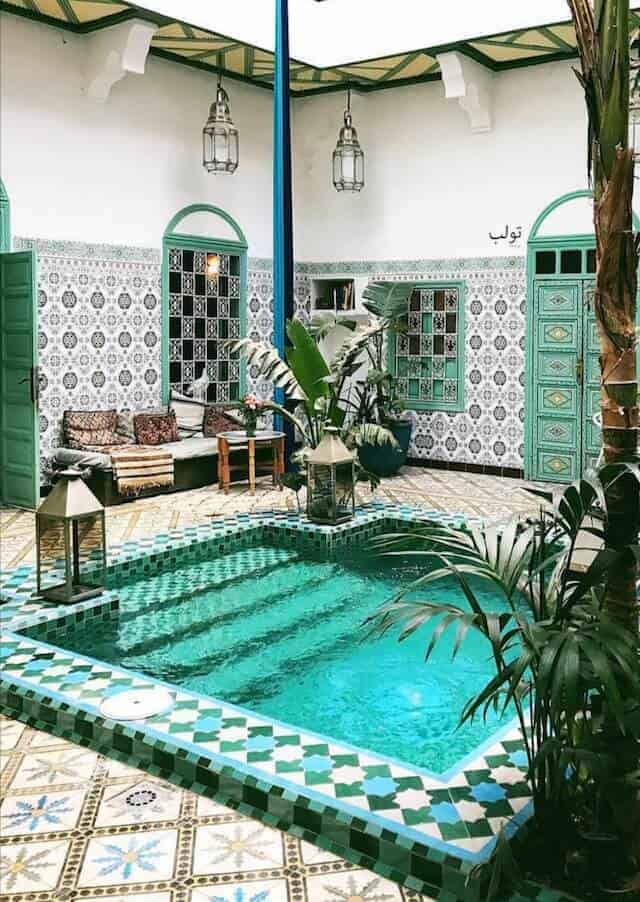
Identify the location of throw pillows. Image resolution: width=640 pixels, height=902 pixels. (95, 424), (161, 415), (192, 409), (225, 416).